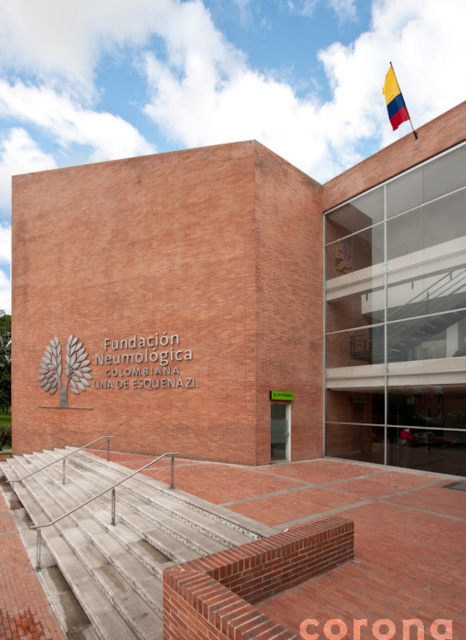
Question: In this image, where is concrete steps at lower left located relative to red fabric flag at upper right?

Choices:
 (A) right
 (B) left

Answer: (B)

Question: Which point is closer to the camera?

Choices:
 (A) concrete steps at lower left
 (B) red fabric flag at upper right

Answer: (A)

Question: Is concrete steps at lower left thinner than red fabric flag at upper right?

Choices:
 (A) yes
 (B) no

Answer: (A)

Question: Which of the following is the closest to the observer?

Choices:
 (A) (68, 488)
 (B) (392, 100)

Answer: (A)

Question: Does concrete steps at lower left appear over red fabric flag at upper right?

Choices:
 (A) no
 (B) yes

Answer: (A)